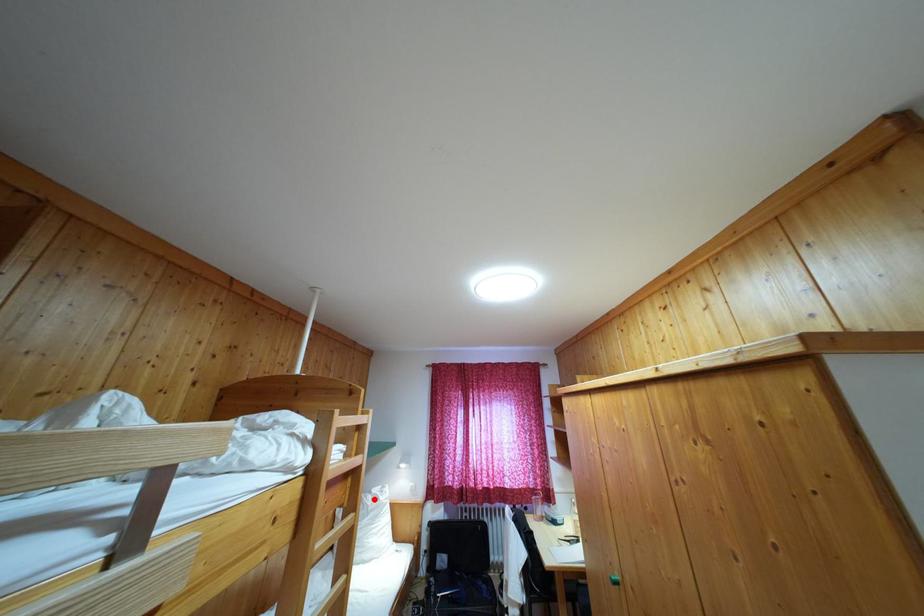
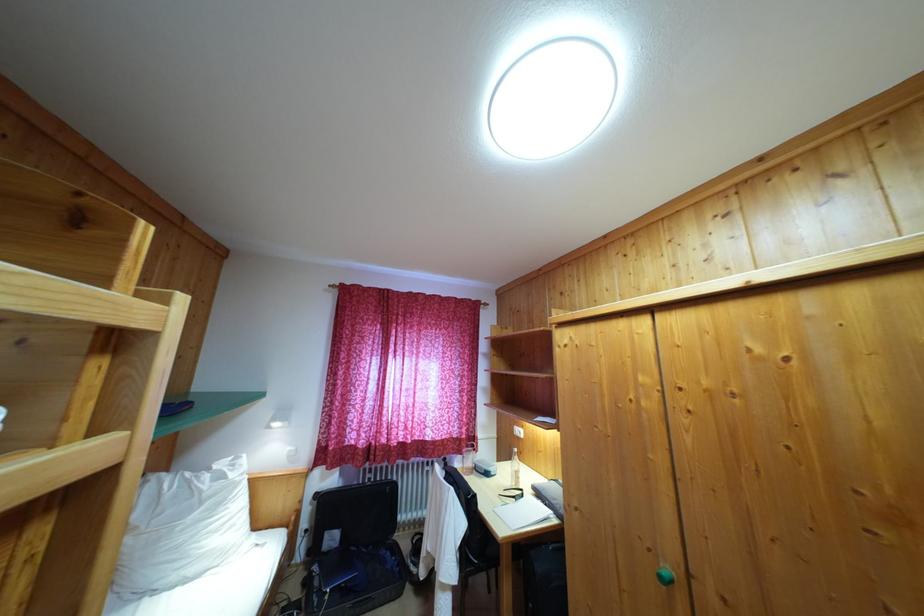
Locate, in the second image, the point that corresponds to the highlighted location in the first image.

(213, 476)